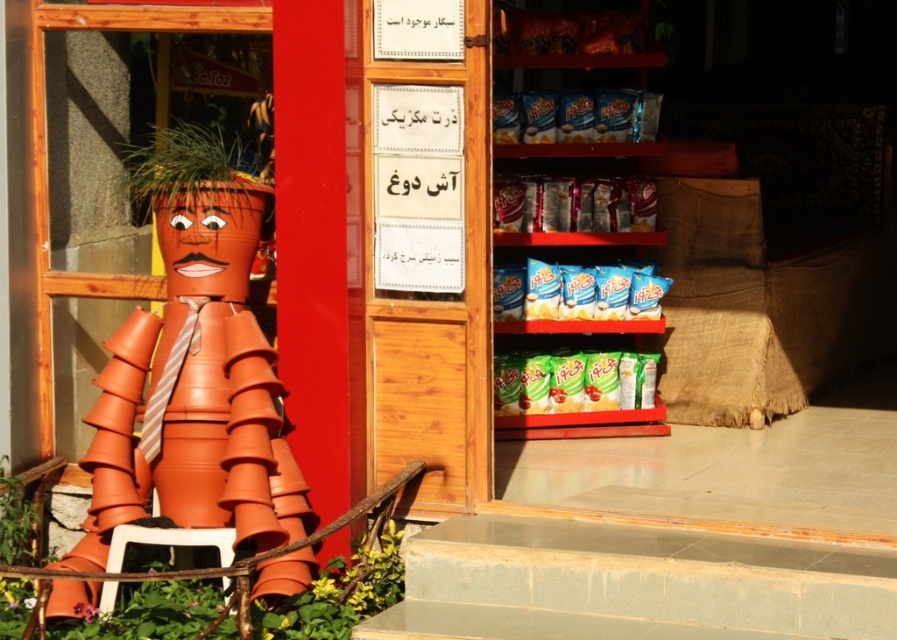
Question: Which of the following is the closest to the observer?

Choices:
 (A) blue glossy chips at upper right
 (B) blue glossy chips at upper center

Answer: (A)

Question: Can you confirm if green matte snack packet at center is positioned to the right of shiny metallic chips at upper right?

Choices:
 (A) no
 (B) yes

Answer: (B)

Question: Which of the following is the farthest from the observer?

Choices:
 (A) (562, 385)
 (B) (546, 112)
 (C) (503, 195)

Answer: (A)

Question: Among these objects, which one is nearest to the camera?

Choices:
 (A) blue glossy chips at upper right
 (B) green matte snack packet at center
 (C) blue glossy chips at upper center
 (D) shiny metallic chips at upper right

Answer: (D)

Question: Is green matte snack packet at center thinner than shiny metallic chips at upper right?

Choices:
 (A) no
 (B) yes

Answer: (A)

Question: In this image, where is green matte snack packet at center located relative to shiny metallic chips at upper right?

Choices:
 (A) left
 (B) right

Answer: (B)